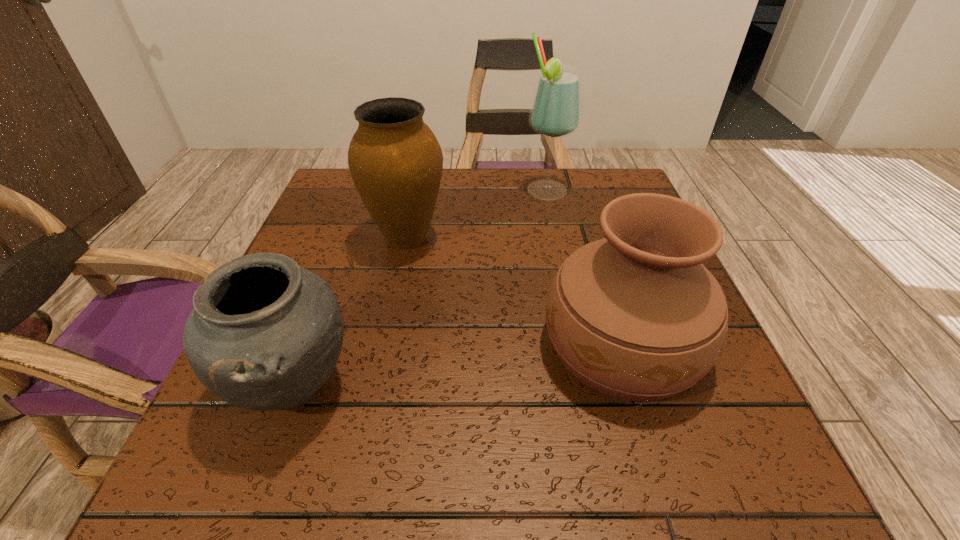
At what (x,y) coordinates should I click in order to perform the action: click on urn that is positioned at the far edge. Please return your answer as a coordinate pair (x, y). Image resolution: width=960 pixels, height=540 pixels. Looking at the image, I should click on (396, 163).

Identify the location of object at the near edge. Image resolution: width=960 pixels, height=540 pixels. (264, 334).

What are the coordinates of `alcohol that is at the right edge` in the screenshot? It's located at (556, 111).

Locate an element on the screen. urn that is at the right edge is located at coordinates (636, 315).

Identify the location of object that is at the far left corner. (396, 163).

This screenshot has height=540, width=960. Find the location of `object located in the near left corner section of the desktop`. object located in the near left corner section of the desktop is located at coordinates click(x=264, y=334).

At what (x,y) coordinates should I click in order to perform the action: click on object present at the far right corner. Please return your answer as a coordinate pair (x, y). Looking at the image, I should click on (556, 111).

At what (x,y) coordinates should I click in order to perform the action: click on free point at the far edge. Please return your answer as a coordinate pair (x, y). The width and height of the screenshot is (960, 540). Looking at the image, I should click on (478, 208).

This screenshot has height=540, width=960. Find the location of `free spot at the near edge of the desktop`. free spot at the near edge of the desktop is located at coordinates 488,460.

Find the location of `vacant space at the left edge`. vacant space at the left edge is located at coordinates (246, 432).